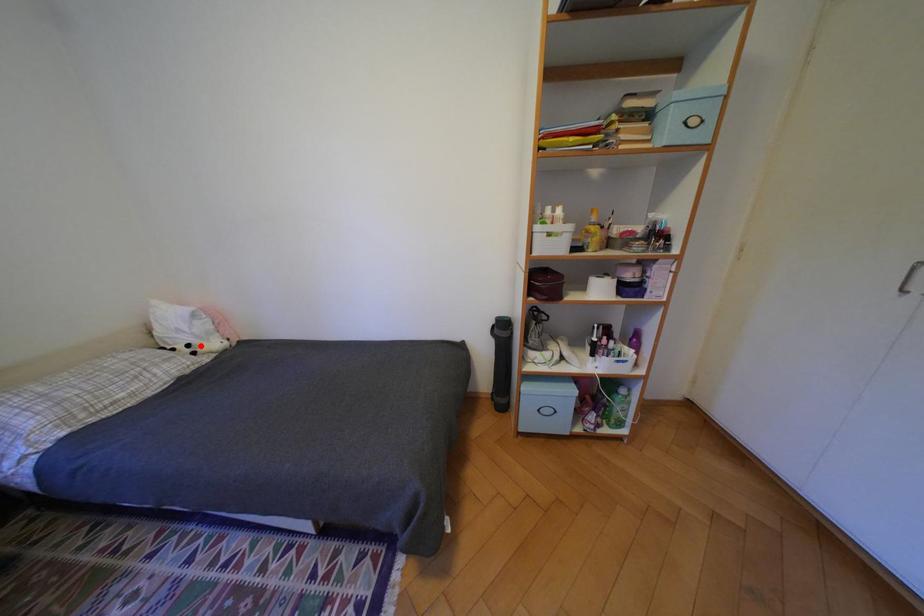
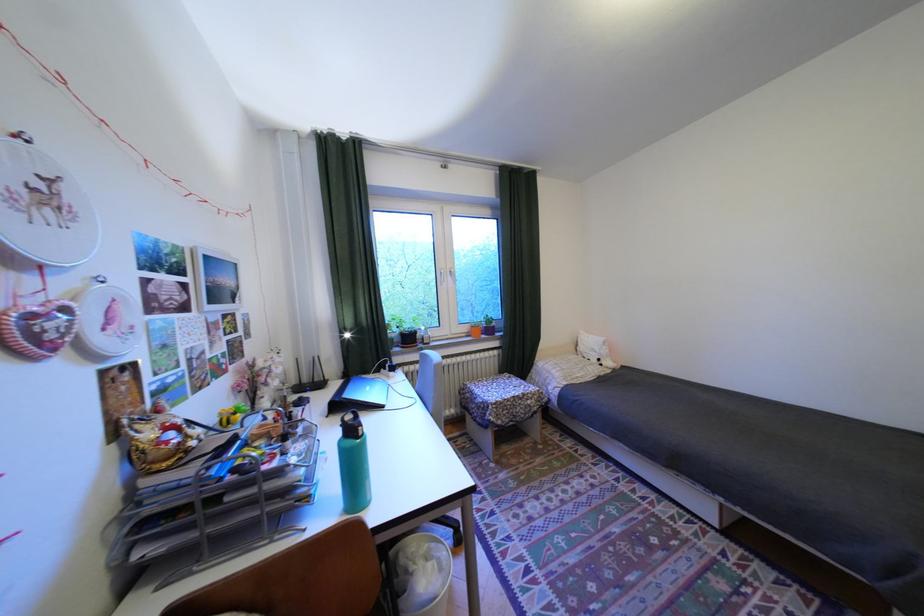
Question: I am providing you with two images of the same scene from different viewpoints. Given a red point in image1, look at the same physical point in image2. Is it:

Choices:
 (A) Closer to the viewpoint
 (B) Farther from the viewpoint

Answer: (B)